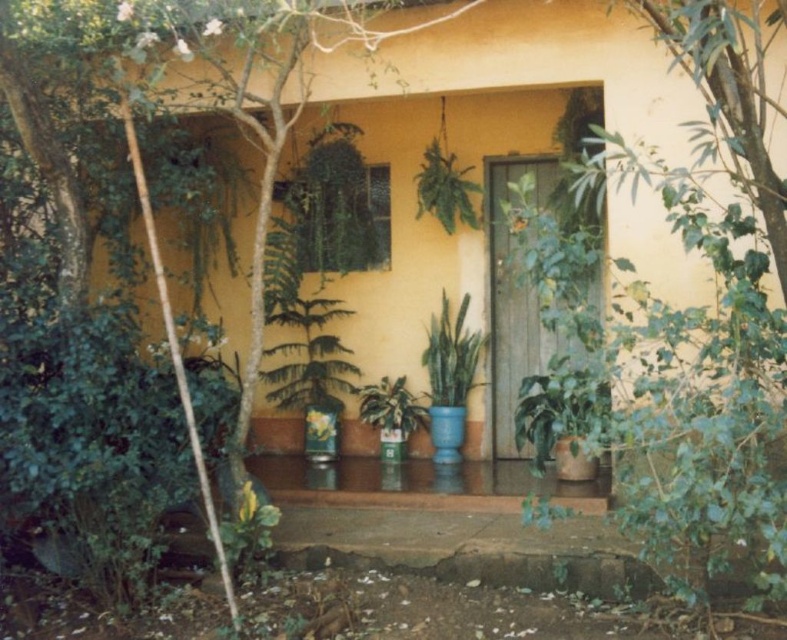
You are standing on the porch and want to move the green leafy tree at center and the green leafy plant at center to make space for a new bench. Which object should you move first if you want to start with the bigger one?

You should move the green leafy tree at center first because it is larger in size than the green leafy plant at center.

You are standing on the porch and want to place a new small statue between the green leafy tree at center and the green leafy plant at center. Which one should you move to make space?

You should move the green leafy tree at center because it is much taller than the green leafy plant at center, so moving the taller one might provide more space.

You are standing on the porch of the house and want to place a new potted plant between the two points marked as point (682, 451) and point (425, 193). Which point should you stand closer to ensure the plant is nearer to the viewer?

You should stand closer to point (682, 451) because it is closer to the viewer than point (425, 193) according to the spatial description provided.